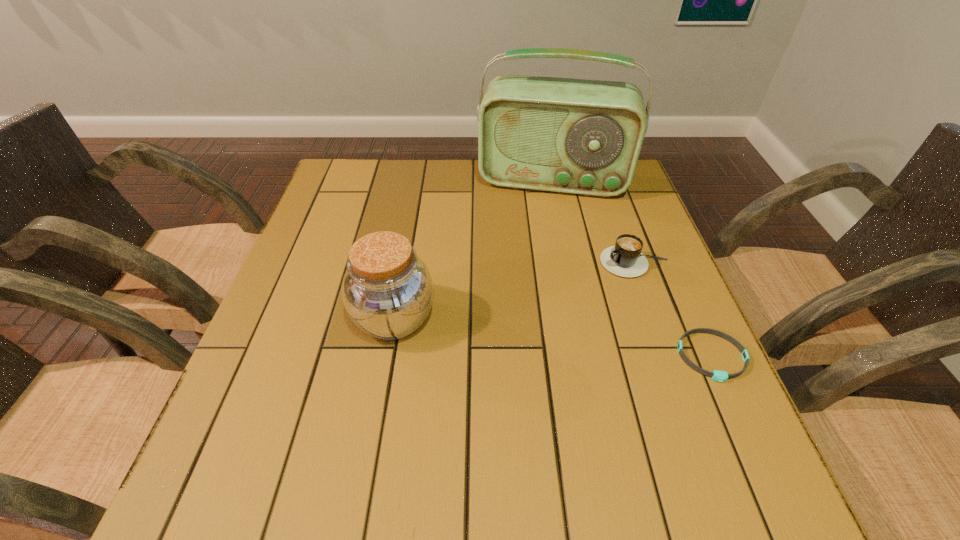
The image size is (960, 540). Find the location of `jar`. jar is located at coordinates (387, 291).

In order to click on the second tallest object in this screenshot , I will do `click(387, 291)`.

Find the location of a particular element. wristband is located at coordinates point(721,376).

In order to click on cappuccino in this screenshot , I will do `click(625, 259)`.

Where is `the second shortest object`? Image resolution: width=960 pixels, height=540 pixels. the second shortest object is located at coordinates (625, 259).

Identify the location of radio receiver. (578, 136).

The height and width of the screenshot is (540, 960). Identify the location of the farthest object. click(578, 136).

Identify the location of vacant region located 0.050m on the left of the jar. [x=328, y=319].

The width and height of the screenshot is (960, 540). I want to click on free space located 0.100m on the buckle of the wristband, so click(x=747, y=435).

This screenshot has height=540, width=960. I want to click on vacant space located with the handle on the side of the second farthest object, so click(573, 291).